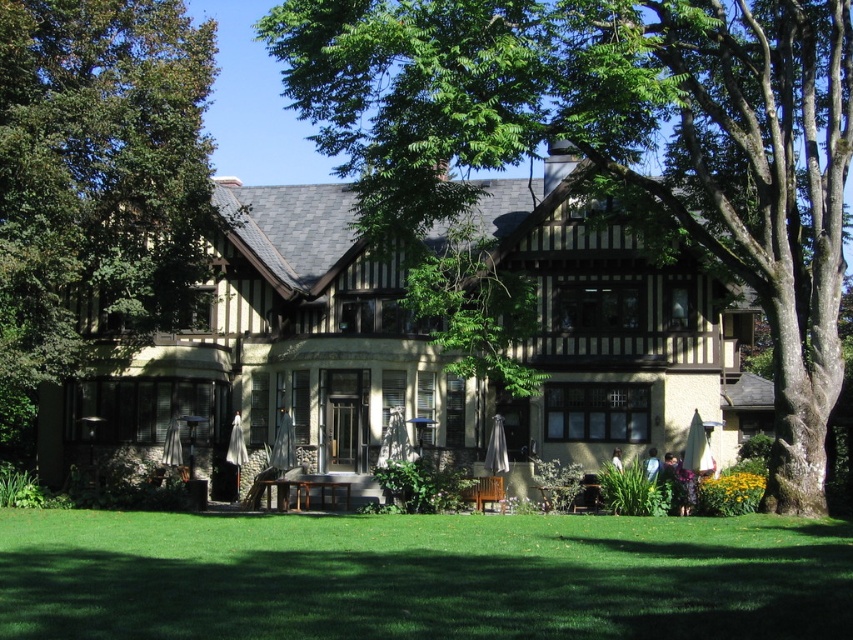
Consider the image. You are standing in front of the house and notice two green leafy trees. Which tree, the green leafy tree at center or the green leafy tree at left, is positioned more to the right side of the house?

The green leafy tree at center is positioned to the right of the green leafy tree at left, so the green leafy tree at center is more to the right side of the house.

You are standing on the green grass at lower center and want to reach the front door of the house. Which direction should you walk to avoid the green leafy tree at center?

Since the green leafy tree at center is positioned over the green grass at lower center, you should walk around the tree either to the left or right to reach the front door without going through the tree.

You are a gardener planning to trim the branches of the green leafy tree at center and the green leafy tree at left. Based on their sizes, which tree requires more time and effort for pruning?

The green leafy tree at center requires more time and effort for pruning because it has a larger size compared to the green leafy tree at left.